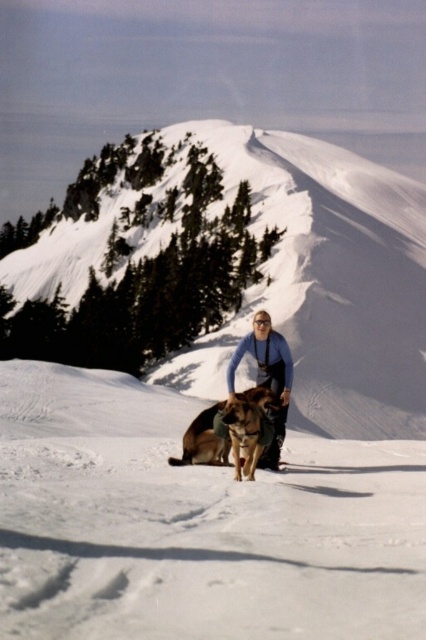
Can you confirm if snowy white mountain at center is wider than light blue fleece jacket at center?

Yes.

Is point (319, 404) farther from camera compared to point (256, 312)?

No.

I want to click on snowy white mountain at center, so click(x=325, y=280).

Can you confirm if white fluffy snow at center is wider than brown fur dog at center?

Yes.

Is white fluffy snow at center shorter than brown fur dog at center?

No.

Image resolution: width=426 pixels, height=640 pixels. Describe the element at coordinates (195, 524) in the screenshot. I see `white fluffy snow at center` at that location.

Where is `white fluffy snow at center`? This screenshot has width=426, height=640. white fluffy snow at center is located at coordinates (195, 524).

Is point (255, 326) less distant than point (215, 440)?

No, it is not.

What do you see at coordinates (267, 376) in the screenshot? I see `light blue fleece jacket at center` at bounding box center [267, 376].

The height and width of the screenshot is (640, 426). In order to click on light blue fleece jacket at center in this screenshot , I will do `click(267, 376)`.